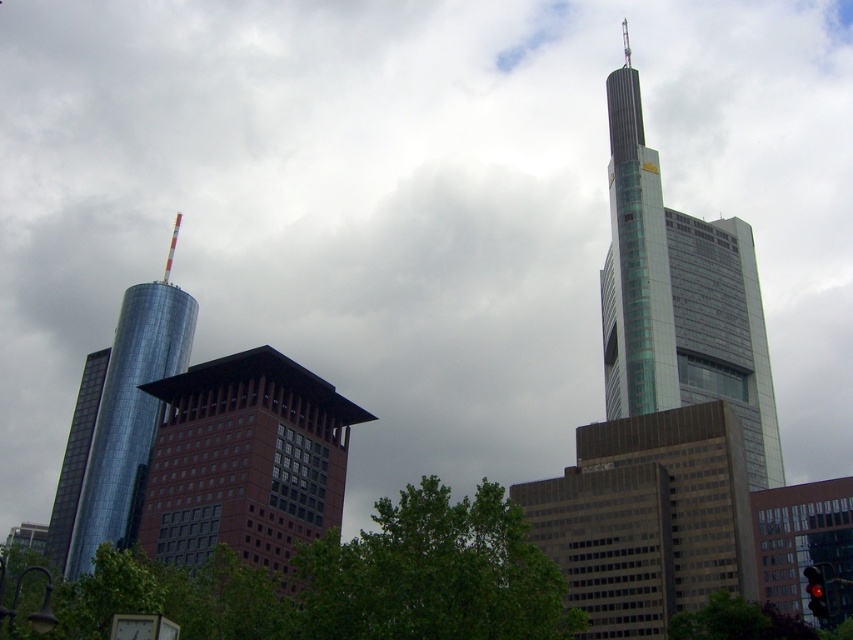
Question: Can you confirm if shiny metallic skyscraper at left is wider than green leafy tree at lower right?

Choices:
 (A) yes
 (B) no

Answer: (A)

Question: Which point is farther from the camera taking this photo?

Choices:
 (A) 109,492
 (B) 757,627
 (C) 427,488

Answer: (A)

Question: Which is farther from the shiny metallic skyscraper at left?

Choices:
 (A) green leafy tree at center
 (B) green leafy tree at lower right
 (C) brown glass building at center
 (D) glassy teal skyscraper at upper right

Answer: (B)

Question: Does glassy teal skyscraper at upper right have a lesser width compared to brown glass building at center?

Choices:
 (A) yes
 (B) no

Answer: (A)

Question: Which object is farther from the camera taking this photo?

Choices:
 (A) glassy teal skyscraper at upper right
 (B) shiny metallic skyscraper at left

Answer: (B)

Question: Can you confirm if brown glass building at center is thinner than green leafy tree at lower right?

Choices:
 (A) no
 (B) yes

Answer: (A)